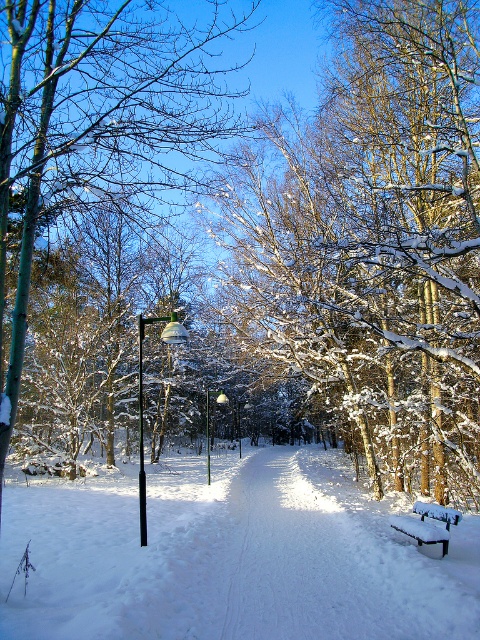
Question: Which object appears farthest from the camera in this image?

Choices:
 (A) metallic pole at center
 (B) black metal lamp post at left

Answer: (A)

Question: Does black metal lamp post at left have a larger size compared to metallic pole at center?

Choices:
 (A) no
 (B) yes

Answer: (B)

Question: Which point is farther from the camera taking this photo?

Choices:
 (A) (139, 353)
 (B) (22, 74)
 (C) (206, 449)

Answer: (C)

Question: Which object appears closest to the camera in this image?

Choices:
 (A) snow-covered trees at center
 (B) white fluffy snow at center
 (C) snow-covered tree at center

Answer: (C)

Question: Where is white fluffy snow at center located in relation to metallic silver pole at center in the image?

Choices:
 (A) below
 (B) above

Answer: (A)

Question: Can you confirm if snow-covered tree at center is positioned above white snow-covered bench at lower right?

Choices:
 (A) no
 (B) yes

Answer: (B)